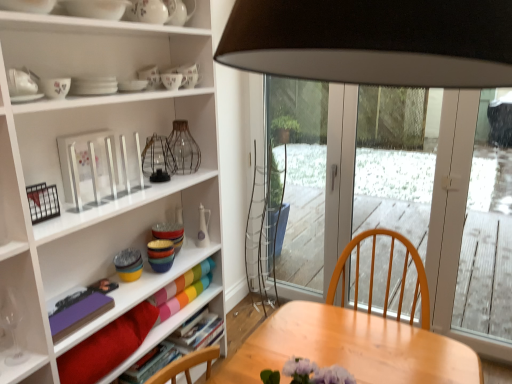
Question: Considering the relative positions of white ceramic vase at center, placed as the third tableware when sorted from bottom to top, and velvet red cushion at lower left in the image provided, is white ceramic vase at center, placed as the third tableware when sorted from bottom to top, to the right of velvet red cushion at lower left from the viewer's perspective?

Choices:
 (A) yes
 (B) no

Answer: (A)

Question: Considering the relative sizes of white ceramic vase at center, the 10th tableware in the top-to-bottom sequence, and velvet red cushion at lower left in the image provided, is white ceramic vase at center, the 10th tableware in the top-to-bottom sequence, shorter than velvet red cushion at lower left?

Choices:
 (A) no
 (B) yes

Answer: (A)

Question: Is velvet red cushion at lower left at the back of white ceramic vase at center, placed as the third tableware when sorted from bottom to top?

Choices:
 (A) no
 (B) yes

Answer: (A)

Question: Is the depth of white ceramic vase at center, the 10th tableware in the top-to-bottom sequence, less than that of velvet red cushion at lower left?

Choices:
 (A) no
 (B) yes

Answer: (A)

Question: Does white ceramic vase at center, placed as the third tableware when sorted from bottom to top, have a smaller size compared to velvet red cushion at lower left?

Choices:
 (A) no
 (B) yes

Answer: (B)

Question: Does point (177, 236) appear closer or farther from the camera than point (163, 8)?

Choices:
 (A) farther
 (B) closer

Answer: (A)

Question: In terms of height, does multicolored glass bowls at center, acting as the 2th tableware starting from the bottom, look taller or shorter compared to white glossy vase at upper center, the twelfth tableware in the bottom-to-top sequence?

Choices:
 (A) tall
 (B) short

Answer: (A)

Question: Is multicolored glass bowls at center, acting as the 2th tableware starting from the bottom, in front of or behind white glossy vase at upper center, which appears as the first tableware when viewed from the top, in the image?

Choices:
 (A) front
 (B) behind

Answer: (B)

Question: From a real-world perspective, is multicolored glass bowls at center, which is the 11th tableware from top to bottom, above or below white glossy vase at upper center, the twelfth tableware in the bottom-to-top sequence?

Choices:
 (A) above
 (B) below

Answer: (B)

Question: Is point (181, 86) positioned closer to the camera than point (158, 162)?

Choices:
 (A) farther
 (B) closer

Answer: (B)

Question: In the image, is porcelain plates at upper center, the fourth tableware viewed from the top, positioned in front of or behind metallic wire basket at upper center, the 9th tableware positioned from the top?

Choices:
 (A) front
 (B) behind

Answer: (B)

Question: Based on their sizes in the image, would you say porcelain plates at upper center, the fourth tableware viewed from the top, is bigger or smaller than metallic wire basket at upper center, the 9th tableware positioned from the top?

Choices:
 (A) big
 (B) small

Answer: (B)

Question: Is porcelain plates at upper center, which is the ninth tableware from bottom to top, taller or shorter than metallic wire basket at upper center, the fourth tableware ordered from the bottom?

Choices:
 (A) short
 (B) tall

Answer: (A)

Question: Is point (175, 246) positioned closer to the camera than point (158, 350)?

Choices:
 (A) closer
 (B) farther

Answer: (B)

Question: From the image's perspective, is multicolored glass bowls at center, which is the 11th tableware from top to bottom, positioned above or below matte red book at lower left, the 3th book from the back?

Choices:
 (A) above
 (B) below

Answer: (A)